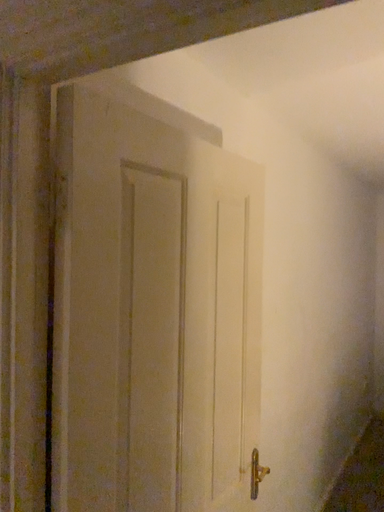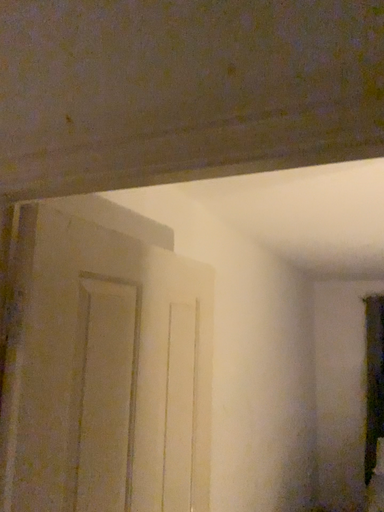
Question: How did the camera likely rotate when shooting the video?

Choices:
 (A) rotated right
 (B) rotated left

Answer: (A)